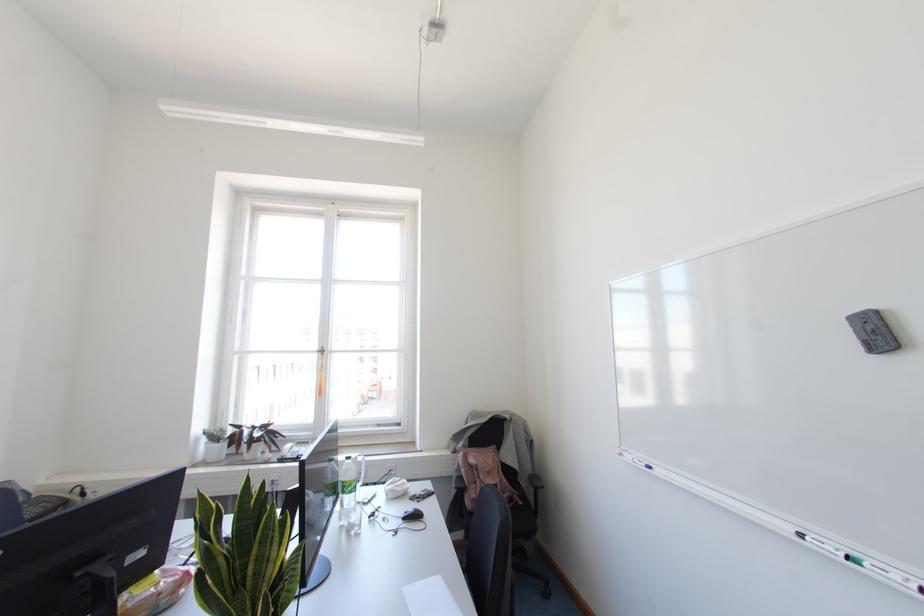
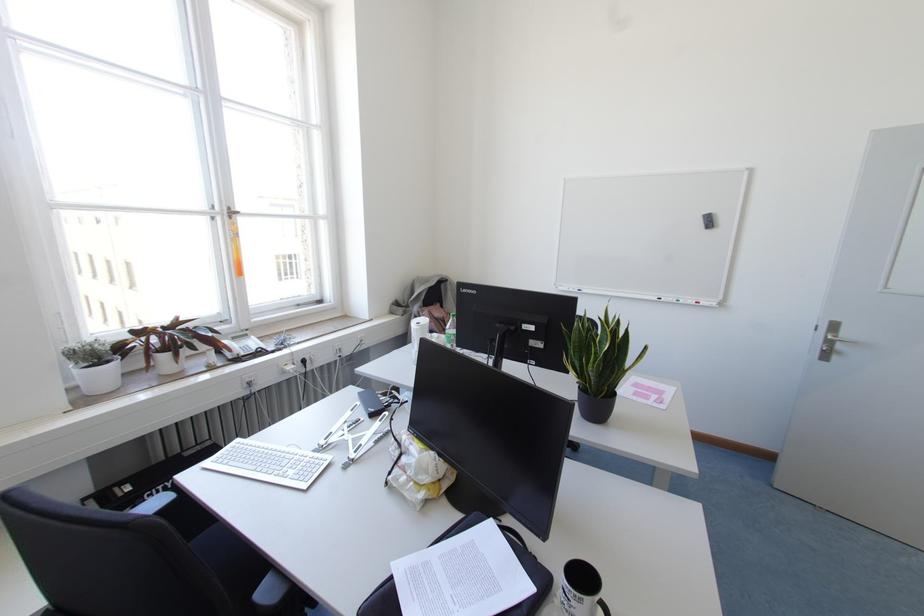
Where in the second image is the point corresponding to point (649, 467) from the first image?

(578, 290)